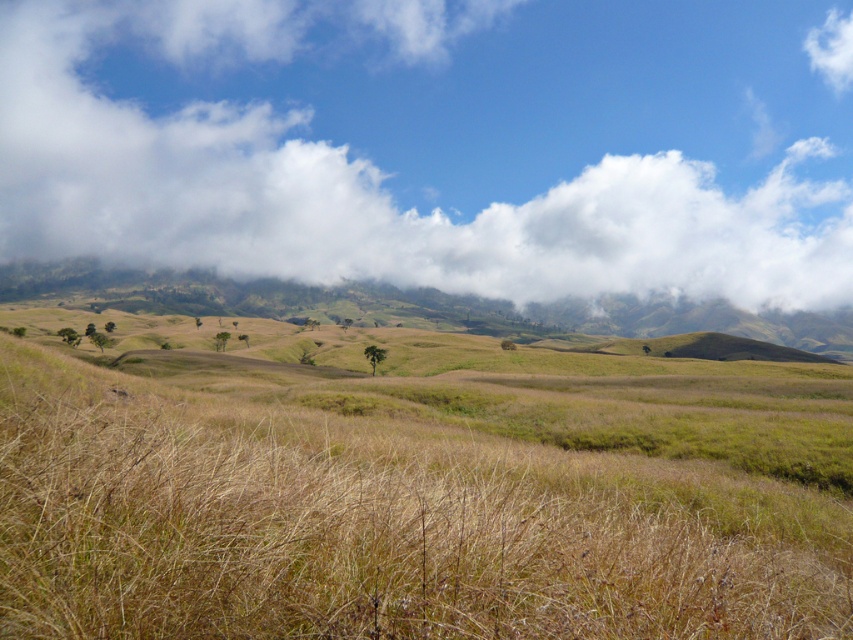
Question: Among these points, which one is farthest from the camera?

Choices:
 (A) (128, 236)
 (B) (119, 497)

Answer: (A)

Question: Among these points, which one is farthest from the camera?

Choices:
 (A) (585, 568)
 (B) (291, 17)

Answer: (B)

Question: Is white fluffy cloud at upper center below dry grass at center?

Choices:
 (A) no
 (B) yes

Answer: (A)

Question: Which point is closer to the camera?

Choices:
 (A) dry grass at center
 (B) white fluffy cloud at upper center

Answer: (A)

Question: Is white fluffy cloud at upper center positioned before dry grass at center?

Choices:
 (A) yes
 (B) no

Answer: (B)

Question: Can you confirm if white fluffy cloud at upper center is thinner than dry grass at center?

Choices:
 (A) yes
 (B) no

Answer: (B)